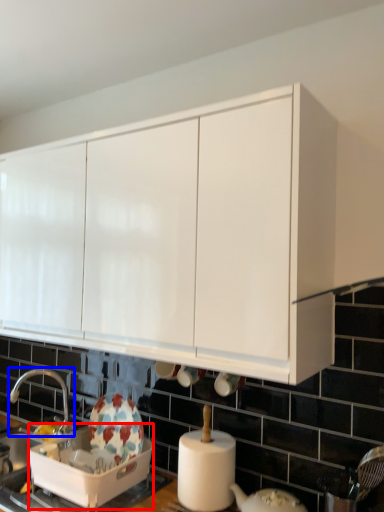
Question: Which object is closer to the camera taking this photo, appliance (highlighted by a red box) or tap (highlighted by a blue box)?

Choices:
 (A) appliance
 (B) tap

Answer: (A)